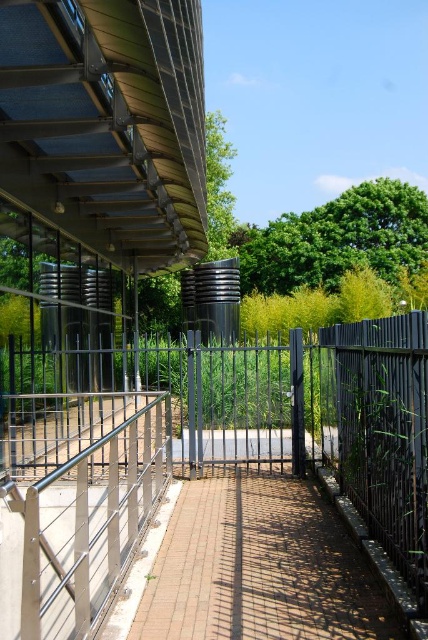
Question: Which of the following is the closest to the observer?

Choices:
 (A) (318, 272)
 (B) (178, 509)
 (C) (259, 388)

Answer: (B)

Question: Is the position of black metal fence at center more distant than that of satin silver railing at lower left?

Choices:
 (A) no
 (B) yes

Answer: (A)

Question: Which point appears farthest from the camera in this image?

Choices:
 (A) (15, 612)
 (B) (95, 532)
 (C) (256, 259)
 (D) (267, 627)

Answer: (C)

Question: Can you confirm if black metal fence at center is positioned to the left of brick paved path at center?

Choices:
 (A) no
 (B) yes

Answer: (B)

Question: Which point is farther to the camera?

Choices:
 (A) green leafy tree at upper center
 (B) brick paved path at center

Answer: (A)

Question: Does black metal fence at center come in front of satin silver railing at lower left?

Choices:
 (A) no
 (B) yes

Answer: (B)